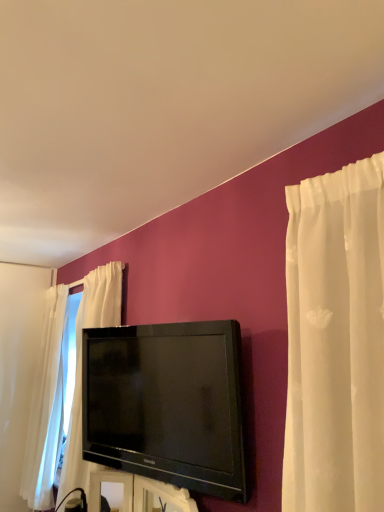
Question: Considering the positions of point (x=99, y=504) and point (x=124, y=458), is point (x=99, y=504) closer or farther from the camera than point (x=124, y=458)?

Choices:
 (A) farther
 (B) closer

Answer: (A)

Question: Do you think black glossy tv at center is within black glossy tv at center, or outside of it?

Choices:
 (A) outside
 (B) inside

Answer: (A)

Question: From a real-world perspective, is black glossy tv at center above or below black glossy tv at center?

Choices:
 (A) above
 (B) below

Answer: (B)

Question: Is point (213, 403) closer or farther from the camera than point (92, 479)?

Choices:
 (A) farther
 (B) closer

Answer: (B)

Question: Would you say black glossy tv at center is inside or outside black glossy tv at center?

Choices:
 (A) outside
 (B) inside

Answer: (A)

Question: Based on their sizes in the image, would you say black glossy tv at center is bigger or smaller than black glossy tv at center?

Choices:
 (A) small
 (B) big

Answer: (B)

Question: From the image's perspective, is black glossy tv at center positioned above or below black glossy tv at center?

Choices:
 (A) below
 (B) above

Answer: (B)